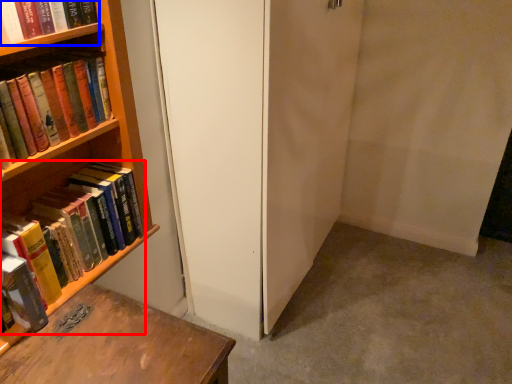
Question: Which point is closer to the camera, book (highlighted by a red box) or book (highlighted by a blue box)?

Choices:
 (A) book
 (B) book

Answer: (B)